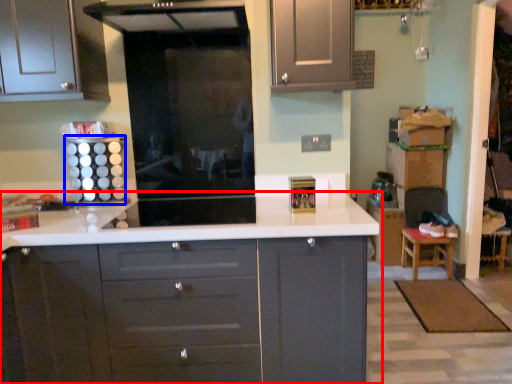
Question: Among these objects, which one is farthest to the camera, countertop (highlighted by a red box) or appliance (highlighted by a blue box)?

Choices:
 (A) countertop
 (B) appliance

Answer: (B)